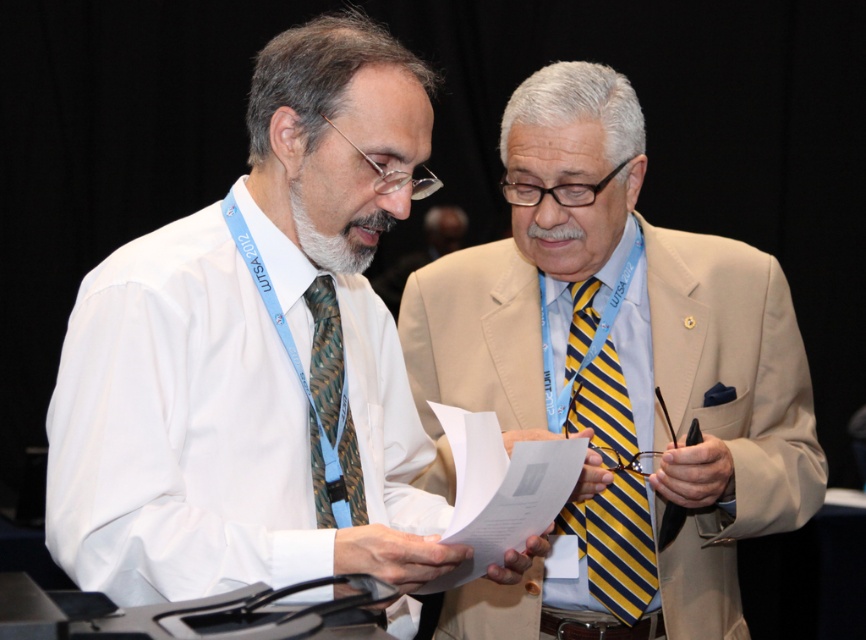
Does point (593, 387) lie in front of point (311, 376)?

No, it is not.

Does yellow striped tie at center have a lesser height compared to green patterned tie at left?

In fact, yellow striped tie at center may be taller than green patterned tie at left.

Does point (598, 563) come behind point (309, 456)?

Yes, it is behind point (309, 456).

Find the location of a particular element. The width and height of the screenshot is (866, 640). yellow striped tie at center is located at coordinates (615, 545).

Who is lower down, white silk shirt at center or green patterned tie at left?

Positioned lower is green patterned tie at left.

Which is behind, point (347, 358) or point (359, 467)?

The point (347, 358) is more distant.

Locate an element on the screen. white silk shirt at center is located at coordinates (254, 353).

From the picture: Does white silk shirt at center lie behind yellow striped tie at center?

No.

Which of these two, white silk shirt at center or yellow striped tie at center, stands shorter?

yellow striped tie at center is shorter.

Who is more forward, (364, 371) or (604, 394)?

Point (364, 371) is more forward.

Image resolution: width=866 pixels, height=640 pixels. Identify the location of white silk shirt at center. click(x=254, y=353).